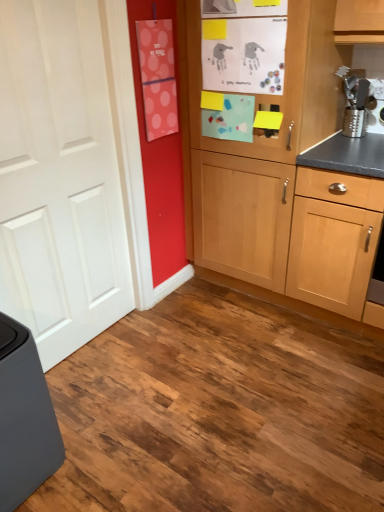
Question: Is white matte door at left outside matte gray trash can at lower left?

Choices:
 (A) no
 (B) yes

Answer: (B)

Question: Does white matte door at left come in front of matte gray trash can at lower left?

Choices:
 (A) no
 (B) yes

Answer: (A)

Question: Is white matte door at left next to matte gray trash can at lower left?

Choices:
 (A) no
 (B) yes

Answer: (A)

Question: Considering the relative sizes of white matte door at left and matte gray trash can at lower left in the image provided, is white matte door at left wider than matte gray trash can at lower left?

Choices:
 (A) yes
 (B) no

Answer: (B)

Question: Is white matte door at left smaller than matte gray trash can at lower left?

Choices:
 (A) no
 (B) yes

Answer: (A)

Question: In terms of size, does metallic silver grater at upper right appear bigger or smaller than light wood cabinet at center?

Choices:
 (A) small
 (B) big

Answer: (A)

Question: Is metallic silver grater at upper right inside the boundaries of light wood cabinet at center, or outside?

Choices:
 (A) outside
 (B) inside

Answer: (B)

Question: In terms of height, does metallic silver grater at upper right look taller or shorter compared to light wood cabinet at center?

Choices:
 (A) short
 (B) tall

Answer: (A)

Question: Considering their positions, is metallic silver grater at upper right located in front of or behind light wood cabinet at center?

Choices:
 (A) behind
 (B) front

Answer: (A)

Question: From their relative heights in the image, would you say light wood cabinet at center is taller or shorter than white matte door at left?

Choices:
 (A) short
 (B) tall

Answer: (B)

Question: Considering the positions of light wood cabinet at center and white matte door at left in the image, is light wood cabinet at center bigger or smaller than white matte door at left?

Choices:
 (A) small
 (B) big

Answer: (B)

Question: Is light wood cabinet at center in front of or behind white matte door at left in the image?

Choices:
 (A) front
 (B) behind

Answer: (B)

Question: In the image, is light wood cabinet at center on the left side or the right side of white matte door at left?

Choices:
 (A) left
 (B) right

Answer: (B)

Question: In terms of height, does light wood cabinet at center look taller or shorter compared to matte gray trash can at lower left?

Choices:
 (A) short
 (B) tall

Answer: (B)

Question: From the image's perspective, relative to matte gray trash can at lower left, is light wood cabinet at center above or below?

Choices:
 (A) below
 (B) above

Answer: (B)